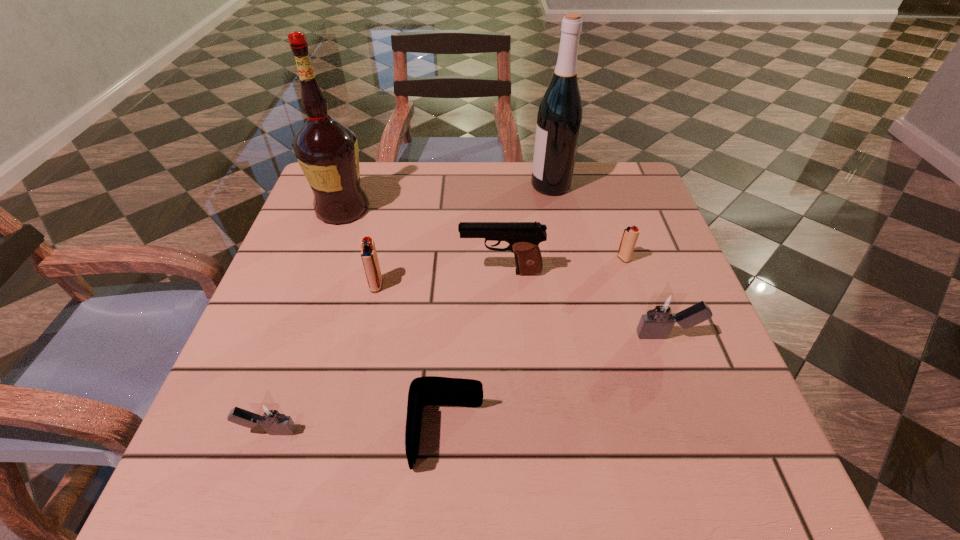
Where is `blank region between the wine bottle and the right gray igniter`? This screenshot has height=540, width=960. blank region between the wine bottle and the right gray igniter is located at coordinates (609, 260).

I want to click on free space that is in between the wallet and the leftmost igniter, so click(x=358, y=433).

Where is `blank region between the third object from right to left and the farther red igniter`? This screenshot has width=960, height=540. blank region between the third object from right to left and the farther red igniter is located at coordinates (587, 222).

Where is `vacant point located between the brown alcohol and the leftmost igniter`? This screenshot has width=960, height=540. vacant point located between the brown alcohol and the leftmost igniter is located at coordinates (305, 320).

Where is `free space between the second nearest igniter and the wallet`? Image resolution: width=960 pixels, height=540 pixels. free space between the second nearest igniter and the wallet is located at coordinates (557, 386).

Locate an element on the screen. Image resolution: width=960 pixels, height=540 pixels. free space that is in between the left red igniter and the brown alcohol is located at coordinates (359, 247).

Where is `empty space between the third object from right to left and the wallet`? The width and height of the screenshot is (960, 540). empty space between the third object from right to left and the wallet is located at coordinates (499, 310).

This screenshot has width=960, height=540. Find the location of `free space between the wallet and the fourth farthest object`. free space between the wallet and the fourth farthest object is located at coordinates (474, 354).

Point out which object is positioned as the third nearest to the nearer red igniter. Please provide its 2D coordinates. Your answer should be formatted as a tuple, i.e. [(x, y)], where the tuple contains the x and y coordinates of a point satisfying the conditions above.

[(430, 390)]

Identify the location of object that is the second closest to the sixth nearest object. The image size is (960, 540). (523, 237).